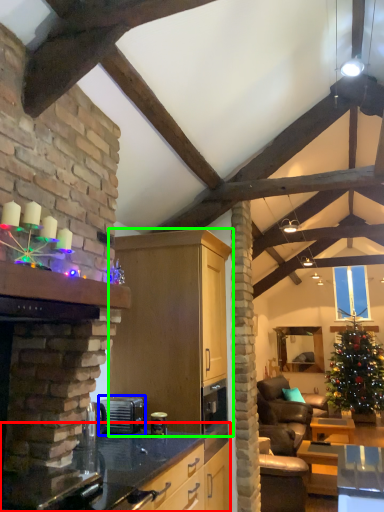
Question: Considering the real-world distances, which object is farthest from countertop (highlighted by a red box)? appliance (highlighted by a blue box) or cabinetry (highlighted by a green box)?

Choices:
 (A) appliance
 (B) cabinetry

Answer: (B)